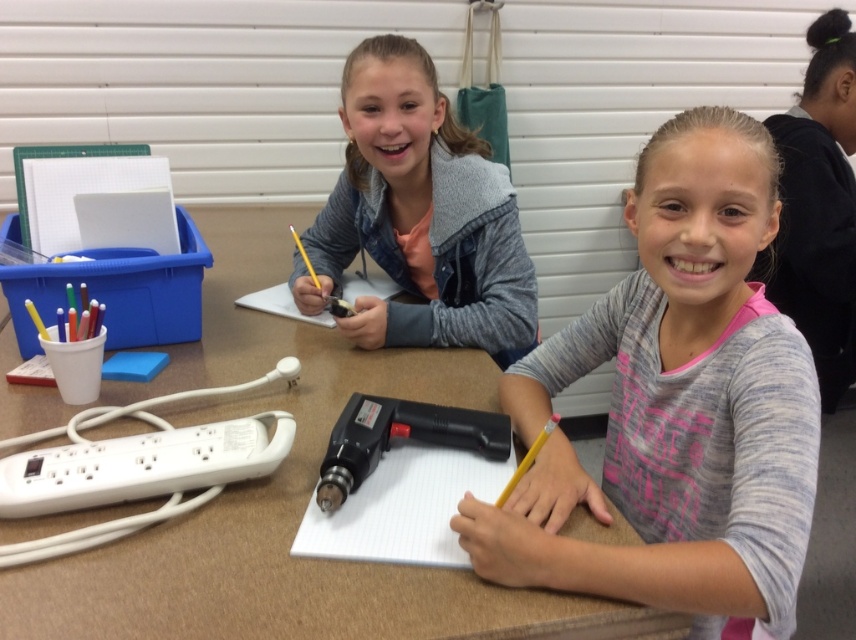
Question: Is gray/white knit sweater at center thinner than gray knit sweater at center?

Choices:
 (A) no
 (B) yes

Answer: (A)

Question: Does brown wood table at center appear under matte black pencil at center?

Choices:
 (A) yes
 (B) no

Answer: (A)

Question: Is brown wood table at center bigger than black plastic glue gun at center?

Choices:
 (A) yes
 (B) no

Answer: (A)

Question: Which point appears farthest from the camera in this image?

Choices:
 (A) (277, 570)
 (B) (770, 516)
 (C) (256, 301)
 (D) (324, 497)

Answer: (C)

Question: Estimate the real-world distances between objects in this image. Which object is closer to the brown wood table at center?

Choices:
 (A) matte gray jacket at upper center
 (B) white paper at center
 (C) matte black pencil at center

Answer: (A)

Question: Which object is farther from the camera taking this photo?

Choices:
 (A) brown wood table at center
 (B) gray knit sweater at center
 (C) matte black pencil at center
 (D) white paper at center

Answer: (B)